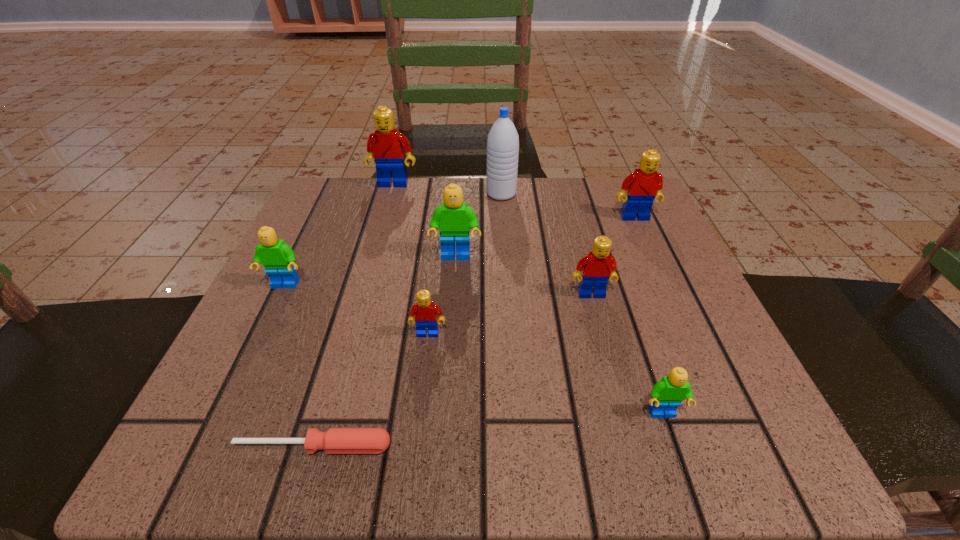
The image size is (960, 540). In the image, there is a desktop. Identify the location of free region at the near right corner. (757, 444).

Where is `unoccupied position between the second red Lego from right to left and the third nearest object`? unoccupied position between the second red Lego from right to left and the third nearest object is located at coordinates (510, 314).

What are the coordinates of `vacant area that lies between the second nearest red Lego and the nearest object` in the screenshot? It's located at (452, 370).

Image resolution: width=960 pixels, height=540 pixels. In order to click on free area in between the sixth nearest Lego and the leftmost red Lego in this screenshot , I will do `click(515, 200)`.

Identify the location of blank region between the rightmost green Lego and the second red Lego from right to left. The height and width of the screenshot is (540, 960). (627, 354).

Where is `vacant area that lies between the third smallest red Lego and the fifth nearest Lego`? This screenshot has height=540, width=960. vacant area that lies between the third smallest red Lego and the fifth nearest Lego is located at coordinates (545, 237).

The image size is (960, 540). I want to click on unoccupied position between the smallest red Lego and the second nearest red Lego, so click(x=510, y=314).

The height and width of the screenshot is (540, 960). I want to click on vacant space that is in between the nearest green Lego and the second red Lego from right to left, so click(x=627, y=354).

Where is `free space between the water bottle and the rightmost red Lego`? The width and height of the screenshot is (960, 540). free space between the water bottle and the rightmost red Lego is located at coordinates (568, 206).

Where is `free area in between the third nearest object and the leftmost Lego`? The height and width of the screenshot is (540, 960). free area in between the third nearest object and the leftmost Lego is located at coordinates (356, 309).